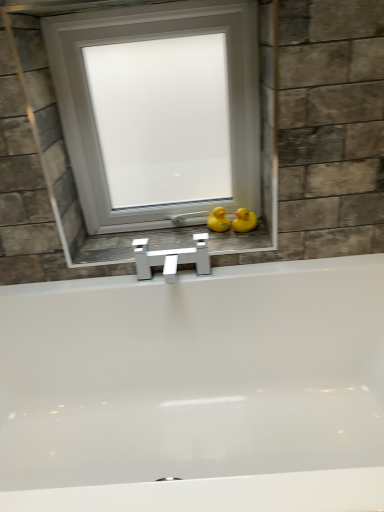
The width and height of the screenshot is (384, 512). Find the location of `vacant space to the left of yellow rubber duck at right, the first duck when ordered from right to left`. vacant space to the left of yellow rubber duck at right, the first duck when ordered from right to left is located at coordinates (196, 239).